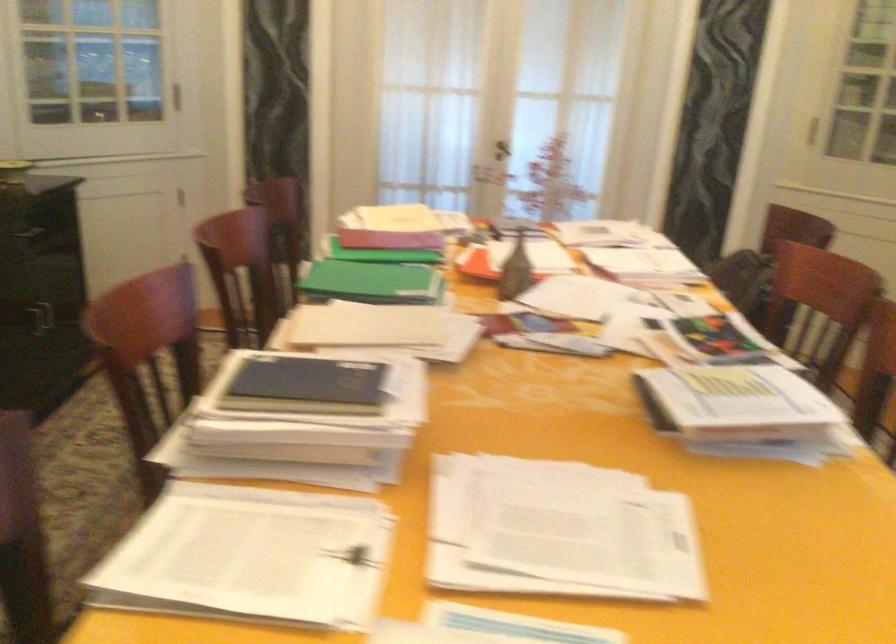
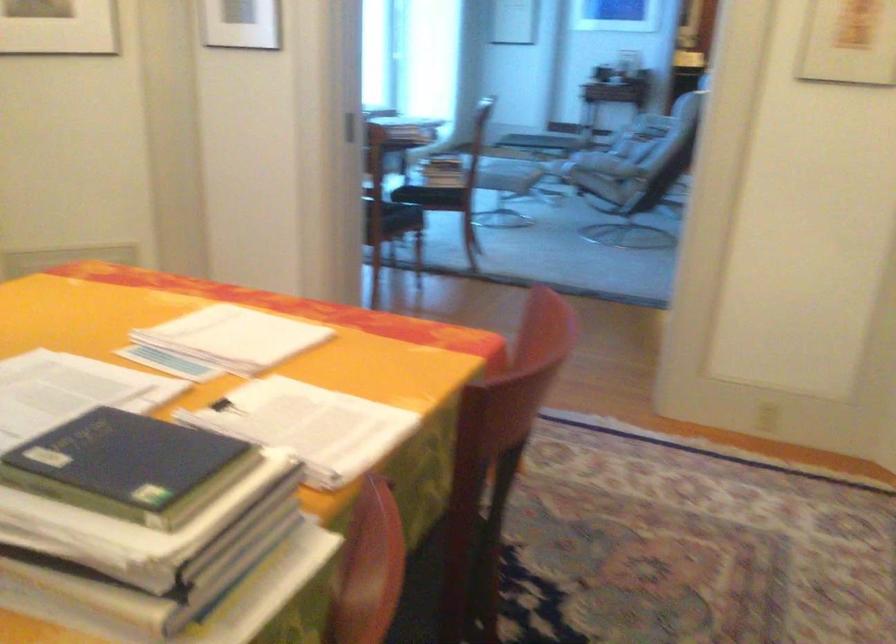
Locate, in the second image, the point that corresponds to (392,383) in the first image.

(128, 466)